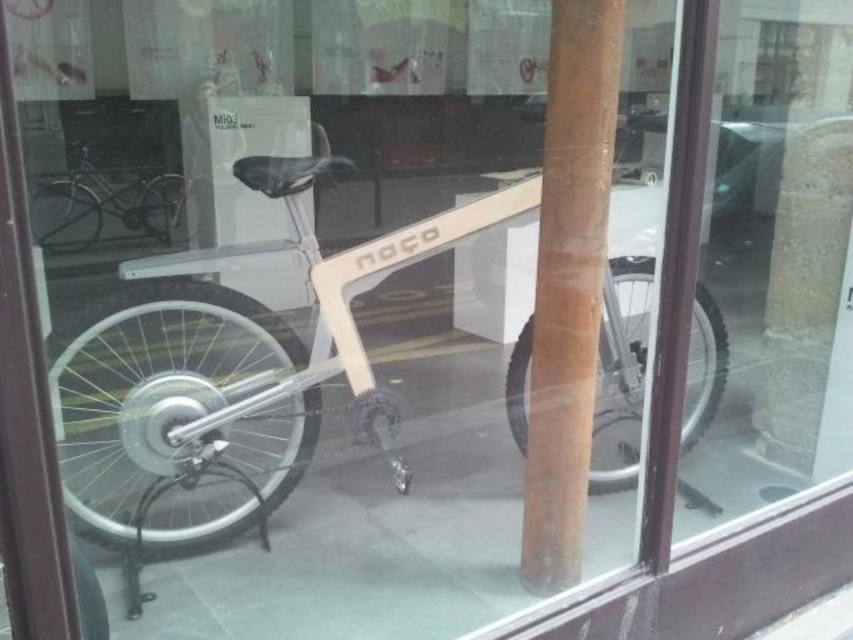
You are a customer in a bike store and want to know if the brown wood pole at center is blocking the path to the matte black bicycle at upper left. Based on the scene description, is the pole positioned in a way that would prevent you from easily reaching the bicycle?

The brown wood pole at center is to the right of the matte black bicycle at upper left, so it is not directly blocking the path to the bicycle. You should be able to reach the matte black bicycle at upper left without any obstruction from the pole.